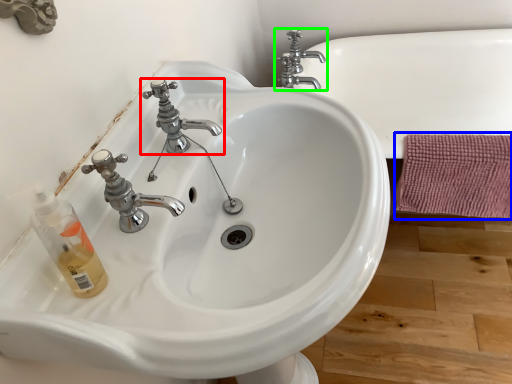
Question: Based on their relative distances, which object is farther from tap (highlighted by a red box)? Choose from bath towel (highlighted by a blue box) and tap (highlighted by a green box).

Choices:
 (A) bath towel
 (B) tap

Answer: (B)